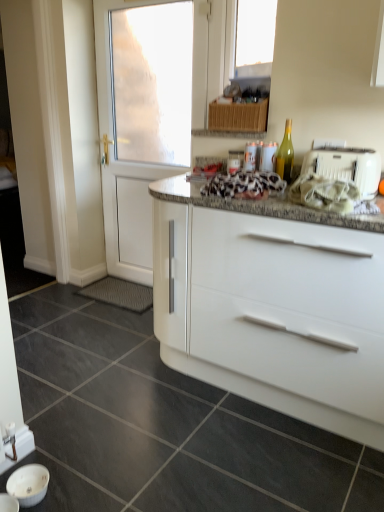
This screenshot has width=384, height=512. Identify the location of vacant area on top of granite at center (from a real-world perspective). (111, 387).